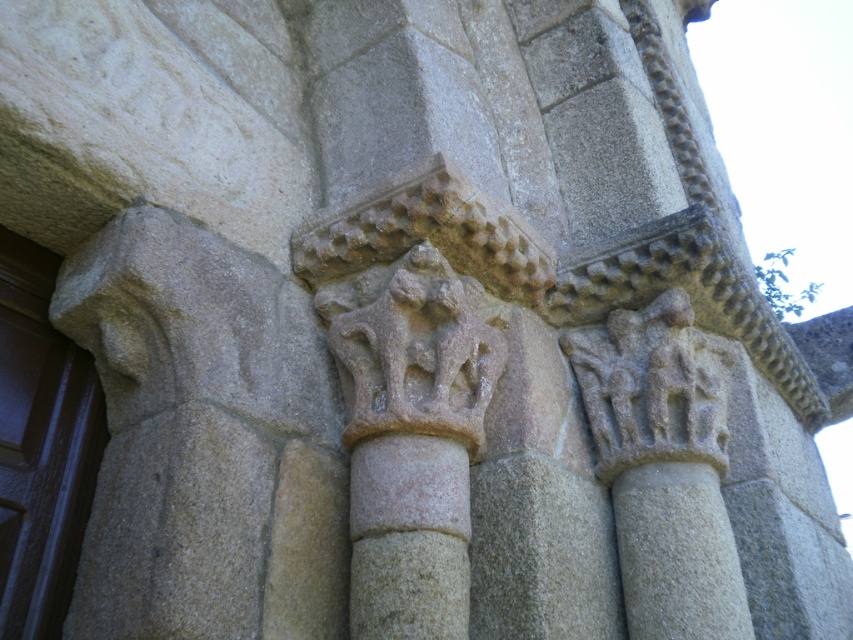
Does pink stone column at center come behind gray stone figures at upper right?

No, pink stone column at center is in front of gray stone figures at upper right.

Does point (397, 625) lie in front of point (721, 428)?

Yes.

You are a GUI agent. You are given a task and a screenshot of the screen. Output one action in this format:
    pyautogui.click(x=<x>, y=<y>)
    Task: Click on the pink stone column at center
    This screenshot has height=640, width=853.
    Given the screenshot: What is the action you would take?
    pyautogui.click(x=408, y=538)

Who is taller, gray stone carving at center or smooth stone column at center?

gray stone carving at center is taller.

Does point (405, 378) come farther from viewer compared to point (688, 573)?

Yes, it is behind point (688, 573).

Find the location of a particular element. Image resolution: width=853 pixels, height=640 pixels. gray stone carving at center is located at coordinates point(415,348).

Is point (438, 616) less distant than point (712, 556)?

Yes.

Who is more distant from viewer, (392, 593) or (641, 634)?

Point (641, 634)

You are a GUI agent. You are given a task and a screenshot of the screen. Output one action in this format:
    pyautogui.click(x=<x>, y=<y>)
    Task: Click on the pink stone column at center
    This screenshot has height=640, width=853.
    Given the screenshot: What is the action you would take?
    pyautogui.click(x=408, y=538)